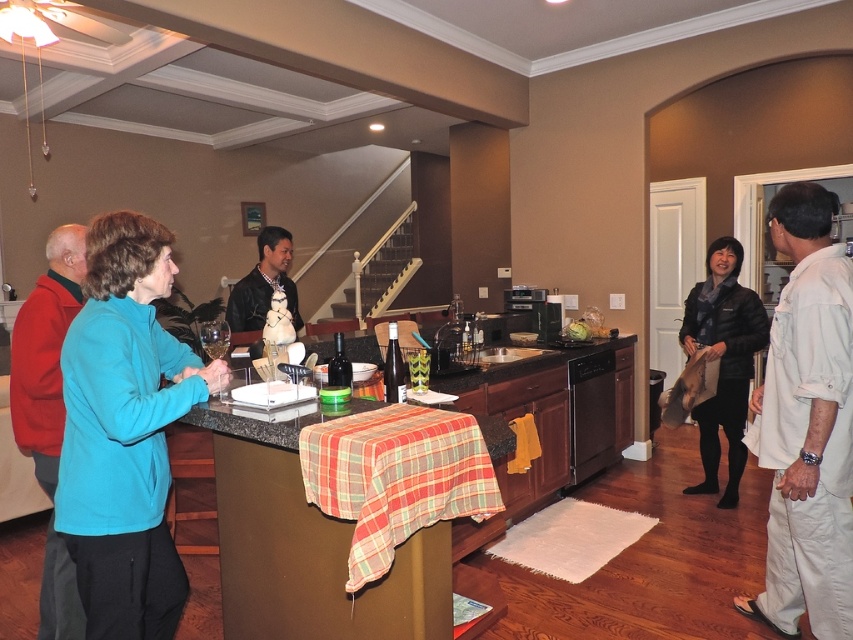
Does white satin shirt at right come behind granite countertop at center?

No, it is in front of granite countertop at center.

Is white satin shirt at right bigger than granite countertop at center?

Actually, white satin shirt at right might be smaller than granite countertop at center.

Who is more forward, (821,371) or (358,333)?

Positioned in front is point (821,371).

The height and width of the screenshot is (640, 853). Find the location of `white satin shirt at right`. white satin shirt at right is located at coordinates (805, 426).

Is teal fleece jacket at left smaller than leather jacket at center?

No, teal fleece jacket at left is not smaller than leather jacket at center.

Looking at this image, who is positioned more to the right, teal fleece jacket at left or leather jacket at center?

From the viewer's perspective, leather jacket at center appears more on the right side.

Who is more distant from viewer, (62, 602) or (260, 316)?

Point (260, 316)

At what (x,y) coordinates should I click in order to perform the action: click on teal fleece jacket at left. Please return your answer as a coordinate pair (x, y). This screenshot has width=853, height=640. Looking at the image, I should click on (45, 353).

Who is positioned more to the left, teal fabric jacket at left or black leather jacket at right?

teal fabric jacket at left

The height and width of the screenshot is (640, 853). What do you see at coordinates (125, 432) in the screenshot? I see `teal fabric jacket at left` at bounding box center [125, 432].

The image size is (853, 640). Find the location of `teal fabric jacket at left`. teal fabric jacket at left is located at coordinates (125, 432).